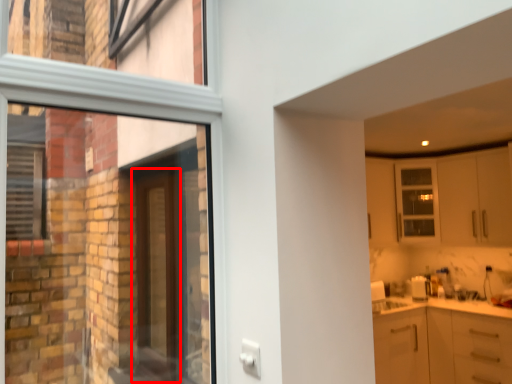
Question: From the image's perspective, where is door (annotated by the red box) located in relation to cabinetry in the image?

Choices:
 (A) above
 (B) below

Answer: (B)